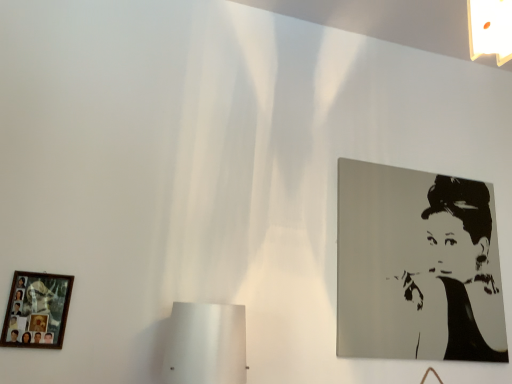
Describe the element at coordinates (37, 310) in the screenshot. I see `wooden photo frame at lower left, the 2th picture frame from the back` at that location.

The height and width of the screenshot is (384, 512). I want to click on wooden photo frame at lower left, the 2th picture frame from the back, so click(x=37, y=310).

This screenshot has width=512, height=384. Describe the element at coordinates (417, 266) in the screenshot. I see `black glossy portrait at upper right, the 2th picture frame from the left` at that location.

What is the approximate height of black glossy portrait at upper right, the 2th picture frame from the left?

The height of black glossy portrait at upper right, the 2th picture frame from the left, is 36.26 inches.

Based on the photo, measure the distance between black glossy portrait at upper right, the 2th picture frame from the left, and camera.

black glossy portrait at upper right, the 2th picture frame from the left, and camera are 5.98 feet apart.

I want to click on black glossy portrait at upper right, the 2th picture frame from the left, so click(x=417, y=266).

Identify the location of wooden photo frame at lower left, the 1th picture frame when ordered from front to back. The height and width of the screenshot is (384, 512). (37, 310).

Consider the image. Can you confirm if wooden photo frame at lower left, marked as the second picture frame in a right-to-left arrangement, is positioned to the right of black glossy portrait at upper right, acting as the first picture frame starting from the back?

No, wooden photo frame at lower left, marked as the second picture frame in a right-to-left arrangement, is not to the right of black glossy portrait at upper right, acting as the first picture frame starting from the back.

Is the depth of wooden photo frame at lower left, the 2th picture frame from the back, greater than that of black glossy portrait at upper right, the 2th picture frame positioned from the front?

No, wooden photo frame at lower left, the 2th picture frame from the back, is in front of black glossy portrait at upper right, the 2th picture frame positioned from the front.

Which point is more forward, (55, 315) or (471, 301)?

The point (55, 315) is in front.

From the image's perspective, which one is positioned lower, wooden photo frame at lower left, the 2th picture frame from the back, or black glossy portrait at upper right, acting as the first picture frame starting from the back?

wooden photo frame at lower left, the 2th picture frame from the back, is shown below in the image.

From a real-world perspective, does wooden photo frame at lower left, the 2th picture frame from the back, stand above black glossy portrait at upper right, acting as the first picture frame starting from the back?

Incorrect, from a real-world perspective, wooden photo frame at lower left, the 2th picture frame from the back, is lower than black glossy portrait at upper right, acting as the first picture frame starting from the back.

Which of these two, wooden photo frame at lower left, the 1th picture frame when ordered from front to back, or black glossy portrait at upper right, the 2th picture frame from the left, is wider?

black glossy portrait at upper right, the 2th picture frame from the left.

Is wooden photo frame at lower left, the 2th picture frame from the back, taller or shorter than black glossy portrait at upper right, which is counted as the first picture frame, starting from the right?

In the image, wooden photo frame at lower left, the 2th picture frame from the back, appears to be shorter than black glossy portrait at upper right, which is counted as the first picture frame, starting from the right.

Who is bigger, wooden photo frame at lower left, the first picture frame when ordered from left to right, or black glossy portrait at upper right, the 2th picture frame from the left?

With larger size is black glossy portrait at upper right, the 2th picture frame from the left.

Is wooden photo frame at lower left, marked as the second picture frame in a right-to-left arrangement, completely or partially outside of black glossy portrait at upper right, which is counted as the first picture frame, starting from the right?

Absolutely, wooden photo frame at lower left, marked as the second picture frame in a right-to-left arrangement, is external to black glossy portrait at upper right, which is counted as the first picture frame, starting from the right.

Is wooden photo frame at lower left, marked as the second picture frame in a right-to-left arrangement, far away from black glossy portrait at upper right, acting as the first picture frame starting from the back?

Yes, wooden photo frame at lower left, marked as the second picture frame in a right-to-left arrangement, and black glossy portrait at upper right, acting as the first picture frame starting from the back, are located far from each other.

Is wooden photo frame at lower left, the 1th picture frame when ordered from front to back, oriented towards black glossy portrait at upper right, the 2th picture frame positioned from the front?

No, wooden photo frame at lower left, the 1th picture frame when ordered from front to back, is not turned towards black glossy portrait at upper right, the 2th picture frame positioned from the front.

The width and height of the screenshot is (512, 384). Find the location of `picture frame that appears on the left of black glossy portrait at upper right, the 2th picture frame from the left`. picture frame that appears on the left of black glossy portrait at upper right, the 2th picture frame from the left is located at coordinates (37, 310).

Considering the relative positions of black glossy portrait at upper right, the 2th picture frame from the left, and wooden photo frame at lower left, the first picture frame when ordered from left to right, in the image provided, is black glossy portrait at upper right, the 2th picture frame from the left, to the left or to the right of wooden photo frame at lower left, the first picture frame when ordered from left to right,?

From the image, it's evident that black glossy portrait at upper right, the 2th picture frame from the left, is to the right of wooden photo frame at lower left, the first picture frame when ordered from left to right.

In the image, is black glossy portrait at upper right, the 2th picture frame positioned from the front, positioned in front of or behind wooden photo frame at lower left, the 1th picture frame when ordered from front to back?

black glossy portrait at upper right, the 2th picture frame positioned from the front, is behind wooden photo frame at lower left, the 1th picture frame when ordered from front to back.

Which point is more forward, (403, 271) or (32, 311)?

The point (32, 311) is more forward.

Looking at this image, from the image's perspective, between black glossy portrait at upper right, acting as the first picture frame starting from the back, and wooden photo frame at lower left, the 2th picture frame from the back, which one is located above?

From the image's view, black glossy portrait at upper right, acting as the first picture frame starting from the back, is above.

Consider the image. From a real-world perspective, who is located lower, black glossy portrait at upper right, the 2th picture frame positioned from the front, or wooden photo frame at lower left, the first picture frame when ordered from left to right?

wooden photo frame at lower left, the first picture frame when ordered from left to right, is physically lower.

From the picture: Considering the relative sizes of black glossy portrait at upper right, acting as the first picture frame starting from the back, and wooden photo frame at lower left, the first picture frame when ordered from left to right, in the image provided, is black glossy portrait at upper right, acting as the first picture frame starting from the back, thinner than wooden photo frame at lower left, the first picture frame when ordered from left to right,?

No.

Considering the sizes of objects black glossy portrait at upper right, the 2th picture frame positioned from the front, and wooden photo frame at lower left, marked as the second picture frame in a right-to-left arrangement, in the image provided, who is taller, black glossy portrait at upper right, the 2th picture frame positioned from the front, or wooden photo frame at lower left, marked as the second picture frame in a right-to-left arrangement,?

Standing taller between the two is black glossy portrait at upper right, the 2th picture frame positioned from the front.

Who is bigger, black glossy portrait at upper right, acting as the first picture frame starting from the back, or wooden photo frame at lower left, the 1th picture frame when ordered from front to back?

black glossy portrait at upper right, acting as the first picture frame starting from the back, is bigger.

Is black glossy portrait at upper right, acting as the first picture frame starting from the back, completely or partially outside of wooden photo frame at lower left, marked as the second picture frame in a right-to-left arrangement?

black glossy portrait at upper right, acting as the first picture frame starting from the back, is positioned outside wooden photo frame at lower left, marked as the second picture frame in a right-to-left arrangement.

Are black glossy portrait at upper right, the 2th picture frame positioned from the front, and wooden photo frame at lower left, marked as the second picture frame in a right-to-left arrangement, located far from each other?

Absolutely, black glossy portrait at upper right, the 2th picture frame positioned from the front, is distant from wooden photo frame at lower left, marked as the second picture frame in a right-to-left arrangement.

Is black glossy portrait at upper right, the 2th picture frame from the left, looking in the opposite direction of wooden photo frame at lower left, marked as the second picture frame in a right-to-left arrangement?

No, black glossy portrait at upper right, the 2th picture frame from the left, is not facing away from wooden photo frame at lower left, marked as the second picture frame in a right-to-left arrangement.

I want to click on picture frame on the left side of black glossy portrait at upper right, which is counted as the first picture frame, starting from the right, so click(x=37, y=310).

In order to click on picture frame below the black glossy portrait at upper right, the 2th picture frame from the left (from the image's perspective) in this screenshot , I will do `click(37, 310)`.

Locate an element on the screen. The height and width of the screenshot is (384, 512). picture frame above the wooden photo frame at lower left, the 1th picture frame when ordered from front to back (from the image's perspective) is located at coordinates (417, 266).